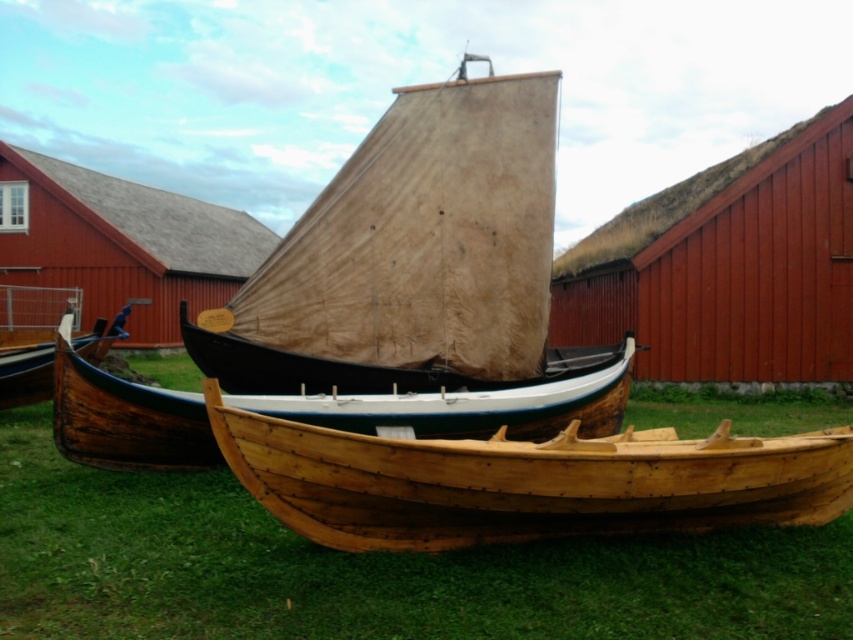
Between point (546, 328) and point (776, 467), which one is positioned in front?

Point (776, 467) is more forward.

Between beige canvas sailboat at center and natural wood canoe at center, which one is positioned lower?

natural wood canoe at center

At what (x,y) coordinates should I click in order to perform the action: click on beige canvas sailboat at center. Please return your answer as a coordinate pair (x, y). This screenshot has width=853, height=640. Looking at the image, I should click on (410, 257).

Between point (235, 481) and point (314, 410), which one is positioned behind?

Positioned behind is point (235, 481).

Locate an element on the screen. Image resolution: width=853 pixels, height=640 pixels. natural wood boat at center is located at coordinates (369, 568).

I want to click on natural wood boat at center, so click(x=369, y=568).

Is natural wood boat at center in front of wooden canoe at lower left?

Yes, it is in front of wooden canoe at lower left.

Between natural wood boat at center and wooden canoe at lower left, which one is positioned higher?

wooden canoe at lower left is above.

Does point (99, 524) come closer to viewer compared to point (12, 358)?

Yes.

At what (x,y) coordinates should I click in order to perform the action: click on natural wood boat at center. Please return your answer as a coordinate pair (x, y). Looking at the image, I should click on (369, 568).